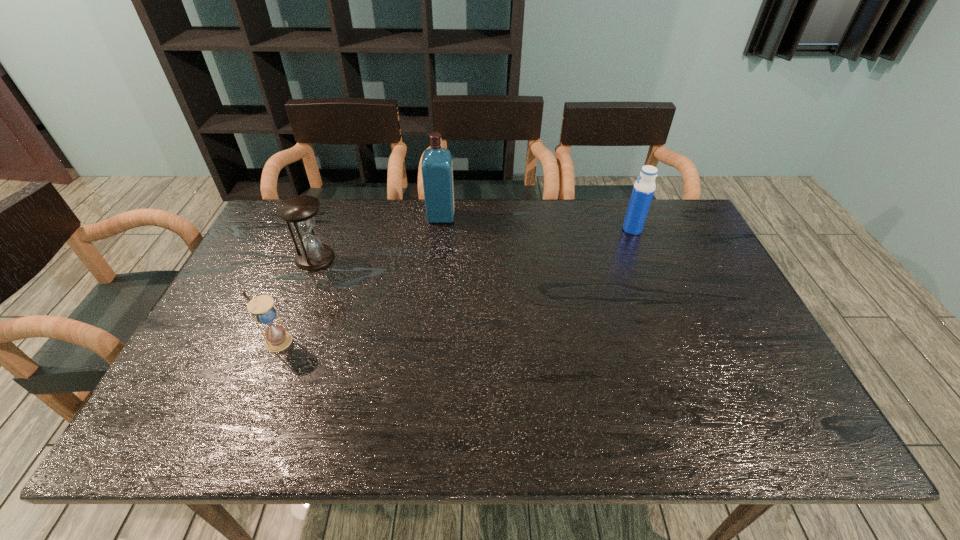
Locate an element on the screen. the tallest object is located at coordinates (437, 165).

The width and height of the screenshot is (960, 540). What are the coordinates of `the second object from right to left` in the screenshot? It's located at (437, 165).

Find the location of `the rightmost object`. the rightmost object is located at coordinates (643, 190).

What are the coordinates of `water bottle` in the screenshot? It's located at (643, 190).

Identify the location of the taller hourglass. Image resolution: width=960 pixels, height=540 pixels. (299, 211).

The width and height of the screenshot is (960, 540). Find the location of `the third tallest object`. the third tallest object is located at coordinates (299, 211).

The width and height of the screenshot is (960, 540). In order to click on the shortest object in this screenshot , I will do `click(261, 307)`.

Where is `the nearest object`? the nearest object is located at coordinates (261, 307).

Where is `free point located 0.080m on the flat label side of the liquor`? free point located 0.080m on the flat label side of the liquor is located at coordinates (478, 216).

Image resolution: width=960 pixels, height=540 pixels. In order to click on free space located 0.110m on the right of the third shortest object in this screenshot , I will do `click(676, 230)`.